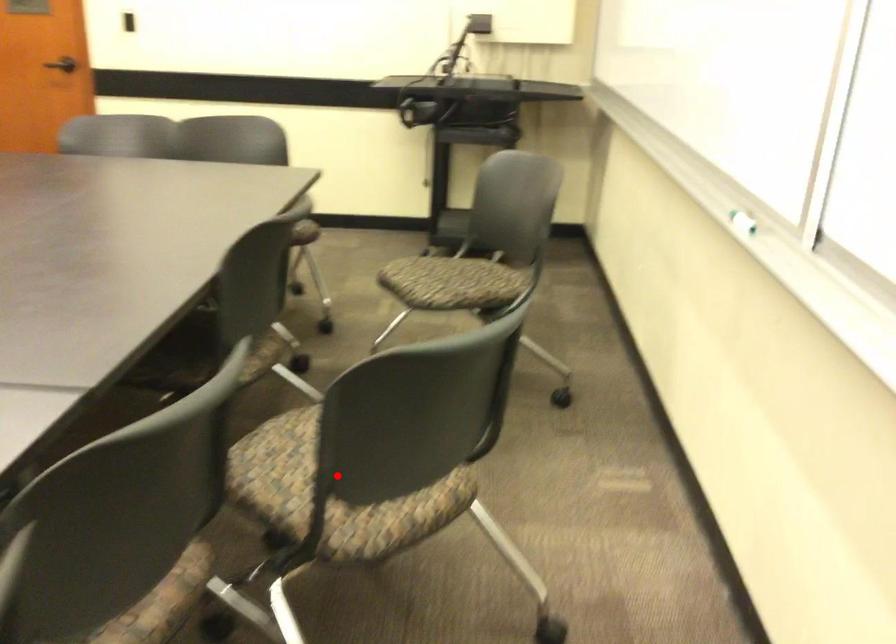
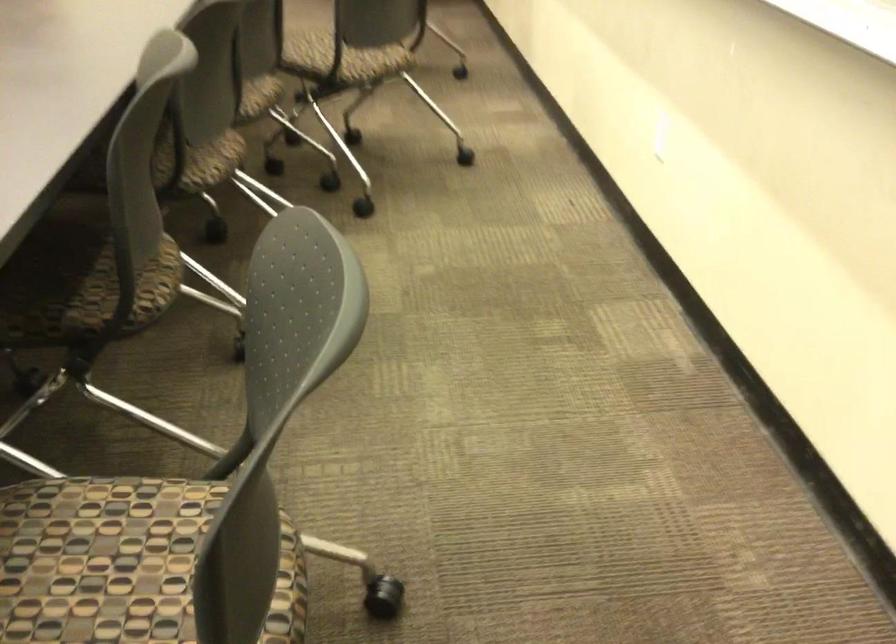
Question: I am providing you with two images of the same scene from different viewpoints. A red point is shown in image1. For the corresponding object point in image2, is it positioned nearer or farther from the camera?

Choices:
 (A) Nearer
 (B) Farther

Answer: (B)